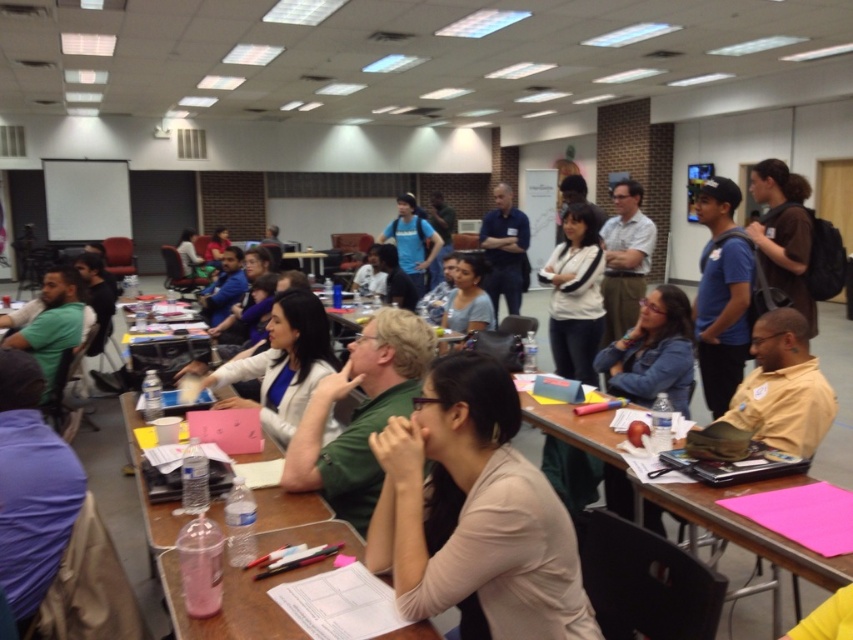
You are standing in the classroom and need to reach the brown wooden table at lower right from the white glossy shirt at center. Which direction should you move towards?

You should move to the right to reach the brown wooden table at lower right since it is located to the right of the white glossy shirt at center.

You are a person standing at the back of the room and want to reach the clear plastic tray at center. The room is 10 feet long. Can you walk directly to the tray without needing to go around any obstacles?

The clear plastic tray at center is 4.38 feet away from the camera, so if you are standing at the back of the room which is 10 feet away from the tray, you would need to walk 5.62 feet forward to reach it. Since there are no mentioned obstacles in the scene description, you can walk directly to the tray.

You are organizing materials in the classroom and need to place a new stack of handouts. The clear plastic tray at center and the brown wooden table at lower right are both available. Which surface is to the left of the other?

The clear plastic tray at center is positioned on the left side of brown wooden table at lower right, so the clear plastic tray at center is to the left of the brown wooden table at lower right.